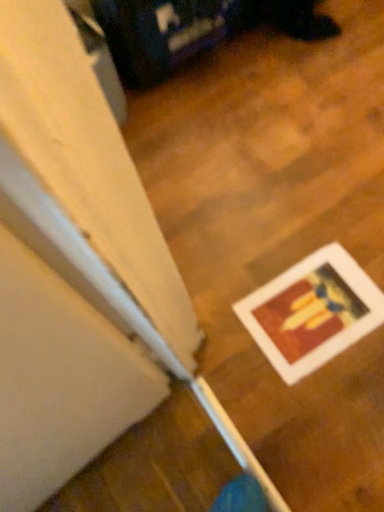
Question: From a real-world perspective, is wooden floor at lower right physically below white matte picture frame at lower right?

Choices:
 (A) no
 (B) yes

Answer: (B)

Question: Can you confirm if wooden floor at lower right is thinner than white matte picture frame at lower right?

Choices:
 (A) yes
 (B) no

Answer: (B)

Question: Does wooden floor at lower right have a greater height compared to white matte picture frame at lower right?

Choices:
 (A) no
 (B) yes

Answer: (A)

Question: Considering the relative sizes of wooden floor at lower right and white matte picture frame at lower right in the image provided, is wooden floor at lower right smaller than white matte picture frame at lower right?

Choices:
 (A) yes
 (B) no

Answer: (B)

Question: Is wooden floor at lower right turned away from white matte picture frame at lower right?

Choices:
 (A) no
 (B) yes

Answer: (A)

Question: Is wooden floor at lower right to the right of white matte picture frame at lower right from the viewer's perspective?

Choices:
 (A) yes
 (B) no

Answer: (B)

Question: From the image's perspective, would you say white matte picture frame at lower right is shown under wooden floor at lower right?

Choices:
 (A) no
 (B) yes

Answer: (B)

Question: From a real-world perspective, is white matte picture frame at lower right below wooden floor at lower right?

Choices:
 (A) yes
 (B) no

Answer: (B)

Question: Is white matte picture frame at lower right taller than wooden floor at lower right?

Choices:
 (A) no
 (B) yes

Answer: (B)

Question: From a real-world perspective, does white matte picture frame at lower right stand above wooden floor at lower right?

Choices:
 (A) yes
 (B) no

Answer: (A)

Question: Can you confirm if white matte picture frame at lower right is wider than wooden floor at lower right?

Choices:
 (A) yes
 (B) no

Answer: (B)

Question: Would you say white matte picture frame at lower right is outside wooden floor at lower right?

Choices:
 (A) yes
 (B) no

Answer: (B)

Question: From a real-world perspective, relative to wooden floor at lower right, is white matte picture frame at lower right vertically above or below?

Choices:
 (A) above
 (B) below

Answer: (A)